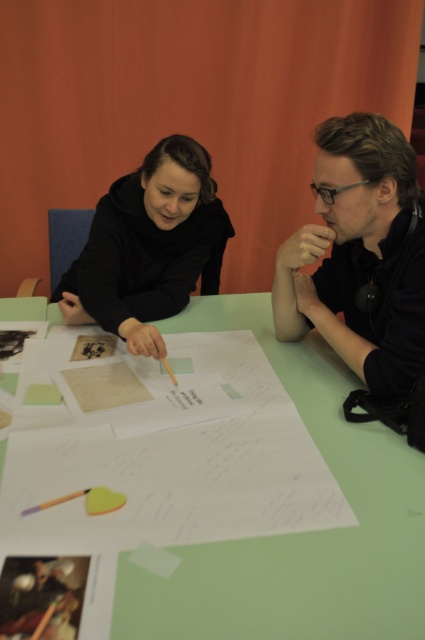
Does green paper at center have a lesser width compared to black matte hoodie at center?

Yes.

Looking at this image, who is shorter, green paper at center or black matte hoodie at center?

green paper at center

What do you see at coordinates (299, 534) in the screenshot?
I see `green paper at center` at bounding box center [299, 534].

Locate an element on the screen. green paper at center is located at coordinates (299, 534).

Is point (408, 316) positioned in front of point (396, 212)?

Yes, it is in front of point (396, 212).

Is black matte paper at center smaller than black matte shirt at center?

No, black matte paper at center is not smaller than black matte shirt at center.

The width and height of the screenshot is (425, 640). Find the location of `black matte paper at center`. black matte paper at center is located at coordinates (360, 256).

Is green paper at center closer to camera compared to black matte shirt at center?

Yes, green paper at center is in front of black matte shirt at center.

Does green paper at center appear on the right side of black matte shirt at center?

Incorrect, green paper at center is not on the right side of black matte shirt at center.

Is point (286, 621) behind point (354, 160)?

No, it is not.

Image resolution: width=425 pixels, height=640 pixels. Find the location of `green paper at center`. green paper at center is located at coordinates (299, 534).